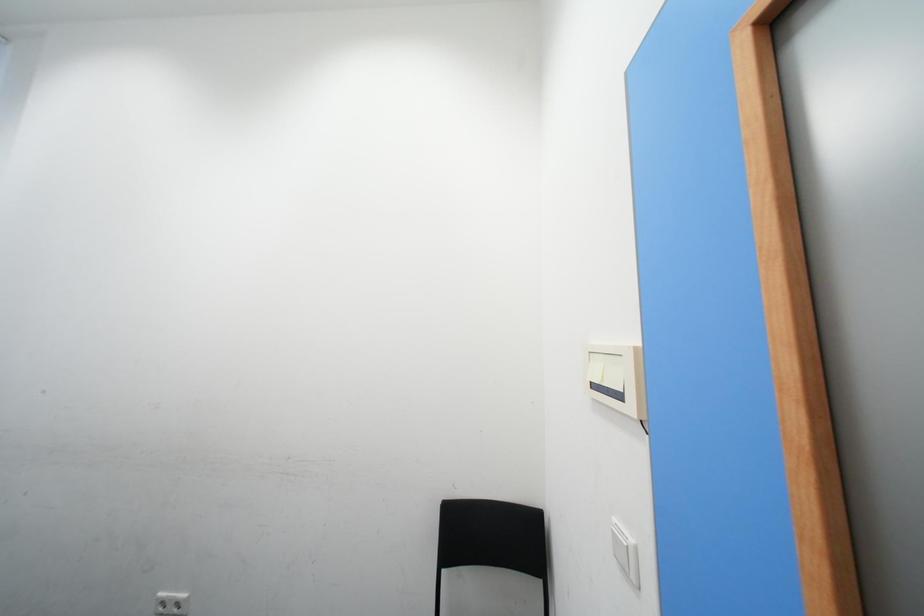
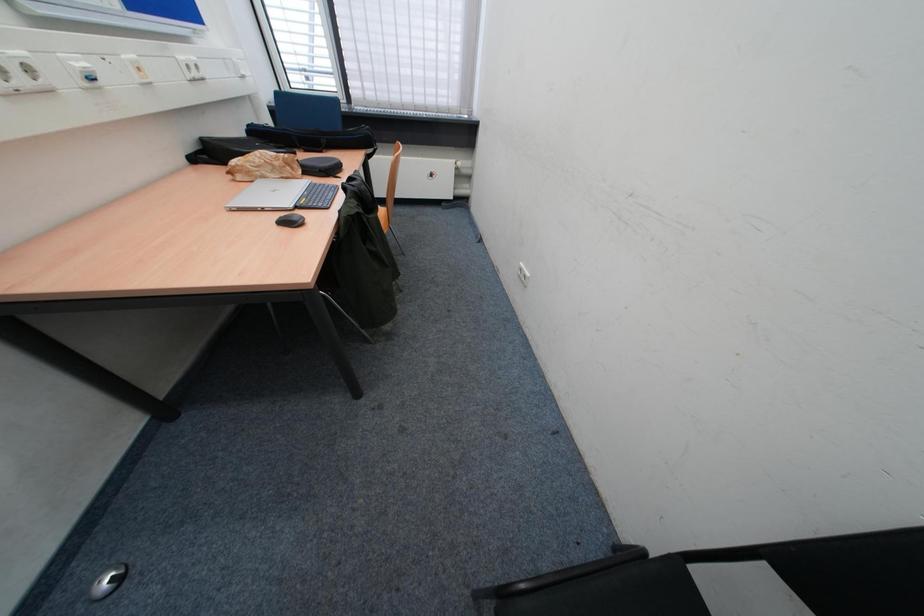
First-person continuous shooting, in which direction is the camera rotating?

The camera rotated toward left-down.